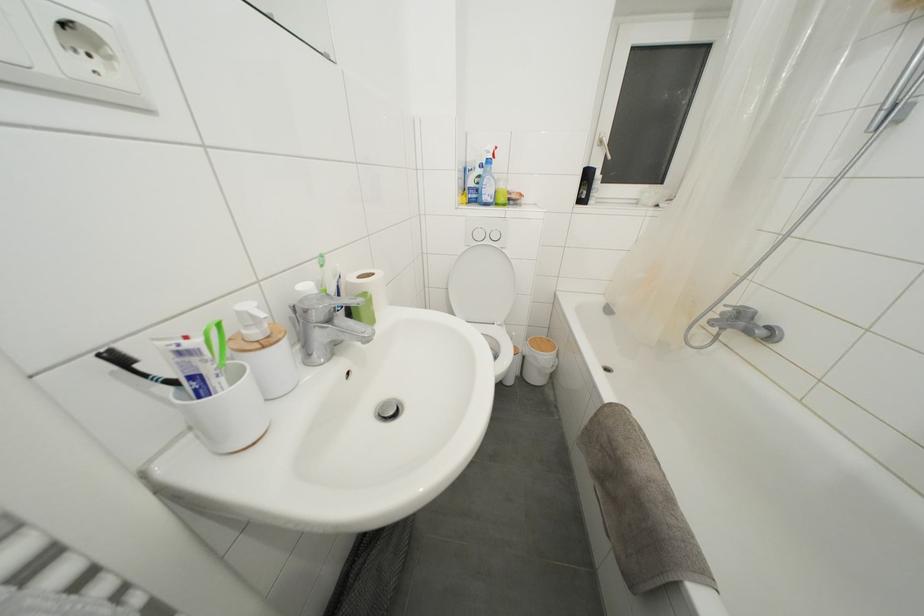
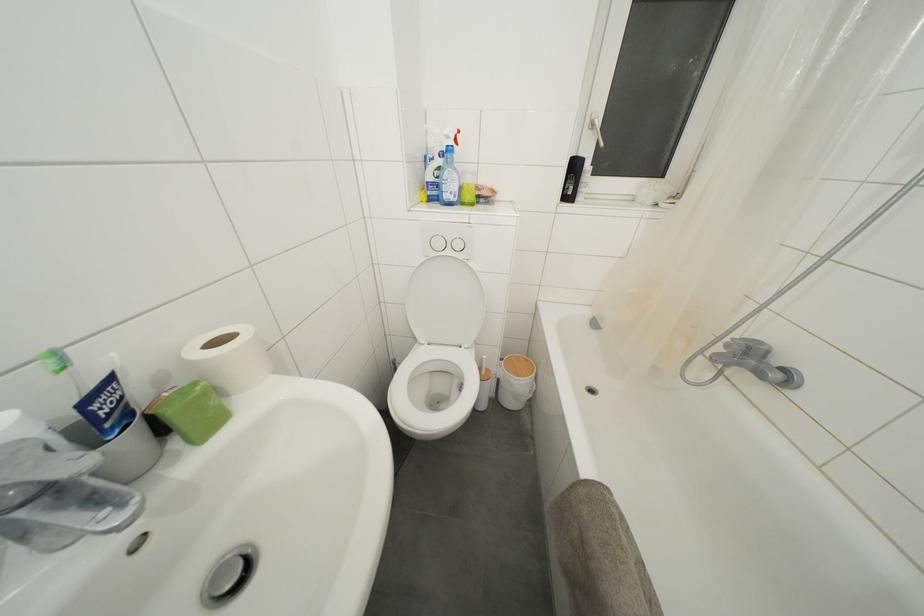
In the second image, find the point that corresponds to (544,342) in the first image.

(521, 362)